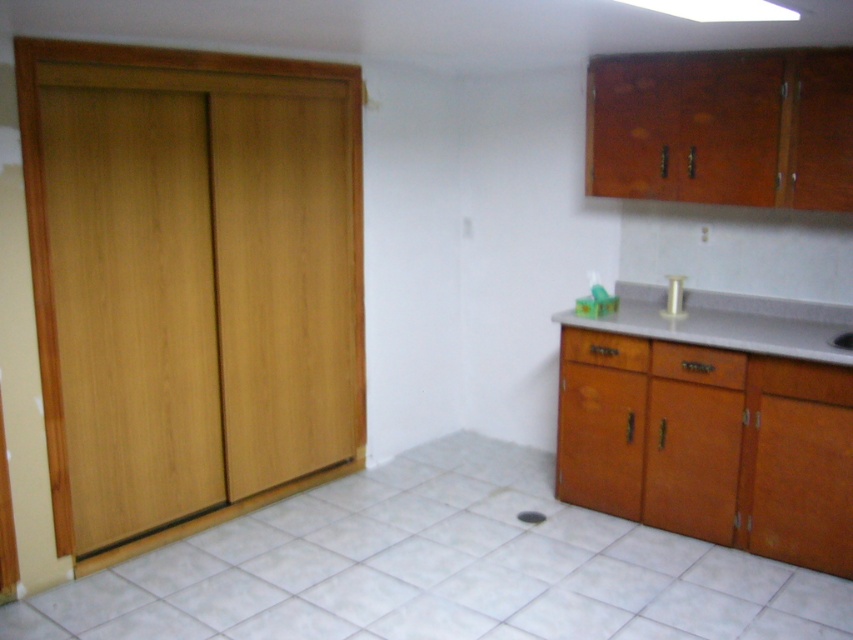
Question: Which of the following is the farthest from the observer?

Choices:
 (A) wooden drawer at lower right
 (B) gray laminate counter at right

Answer: (A)

Question: Which point is closer to the camera?

Choices:
 (A) (781, 301)
 (B) (567, 333)

Answer: (B)

Question: Which of the following is the closest to the observer?

Choices:
 (A) (567, 356)
 (B) (722, 308)

Answer: (A)

Question: Is wooden drawer at lower center behind wooden drawer at lower right?

Choices:
 (A) yes
 (B) no

Answer: (B)

Question: Considering the relative positions of gray laminate counter at right and wooden drawer at lower center in the image provided, where is gray laminate counter at right located with respect to wooden drawer at lower center?

Choices:
 (A) right
 (B) left

Answer: (A)

Question: Does wooden drawer at lower center come in front of wooden drawer at lower right?

Choices:
 (A) yes
 (B) no

Answer: (A)